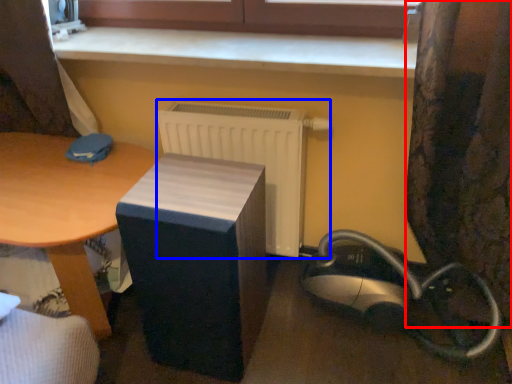
Question: Among these objects, which one is nearest to the camera, curtain (highlighted by a red box) or radiator (highlighted by a blue box)?

Choices:
 (A) curtain
 (B) radiator

Answer: (A)